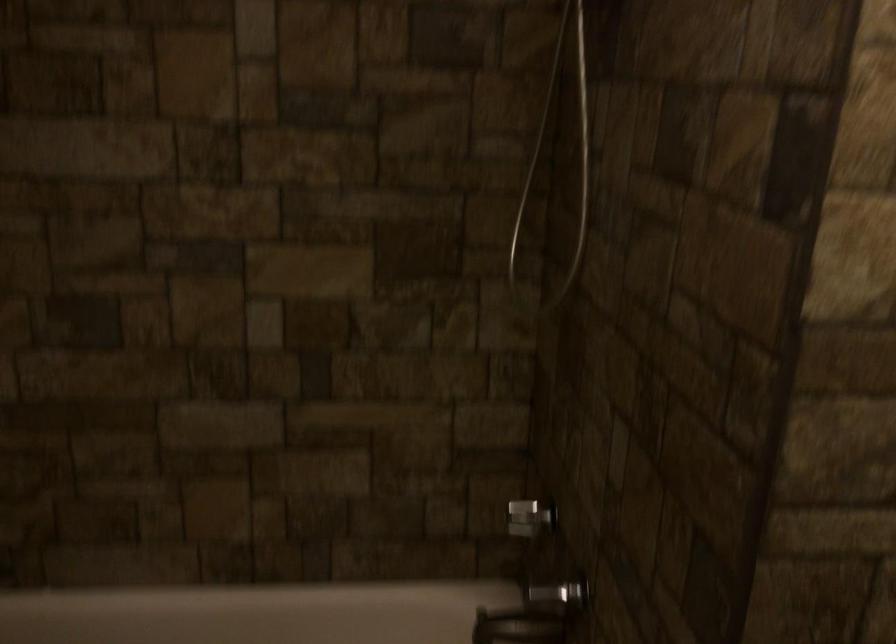
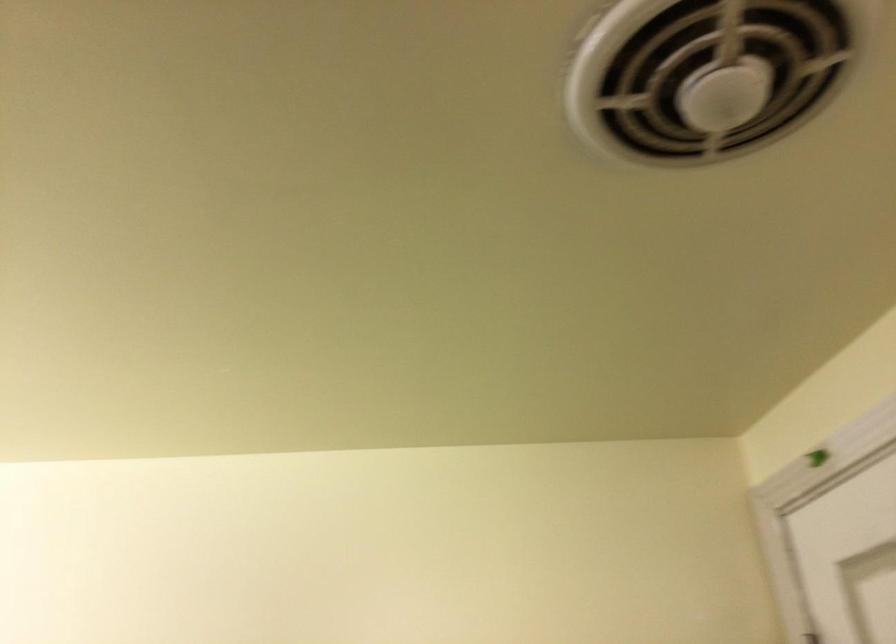
The images are taken continuously from a first-person perspective. In which direction is your viewpoint rotating?

The camera rotated toward right-up.